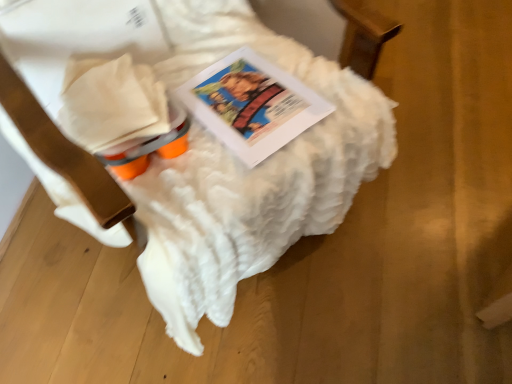
Measure the distance between matte paper book at center and camera.

matte paper book at center and camera are 30.23 inches apart.

Find the location of `matte paper book at center`. matte paper book at center is located at coordinates (251, 105).

This screenshot has width=512, height=384. Describe the element at coordinates (251, 105) in the screenshot. I see `matte paper book at center` at that location.

This screenshot has width=512, height=384. Describe the element at coordinates (248, 172) in the screenshot. I see `white fluffy blanket at upper center` at that location.

In order to face white fluffy blanket at upper center, should I rotate leftwards or rightwards?

To align with it, rotate left about 9.264°.

Find the location of a particular element. white fluffy blanket at upper center is located at coordinates (248, 172).

Where is `matte paper book at center`? The image size is (512, 384). matte paper book at center is located at coordinates (251, 105).

Which is more to the left, white fluffy blanket at upper center or matte paper book at center?

white fluffy blanket at upper center is more to the left.

Is white fluffy blanket at upper center closer to camera compared to matte paper book at center?

Yes, white fluffy blanket at upper center is closer to the camera.

Between point (199, 245) and point (284, 95), which one is positioned behind?

The point (284, 95) is farther from the camera.

From the image's perspective, is white fluffy blanket at upper center beneath matte paper book at center?

No, from the image's perspective, white fluffy blanket at upper center is not below matte paper book at center.

From a real-world perspective, who is located lower, white fluffy blanket at upper center or matte paper book at center?

matte paper book at center is physically lower.

Considering the relative sizes of white fluffy blanket at upper center and matte paper book at center in the image provided, is white fluffy blanket at upper center thinner than matte paper book at center?

In fact, white fluffy blanket at upper center might be wider than matte paper book at center.

Does white fluffy blanket at upper center have a lesser height compared to matte paper book at center?

In fact, white fluffy blanket at upper center may be taller than matte paper book at center.

Based on their sizes in the image, would you say white fluffy blanket at upper center is bigger or smaller than matte paper book at center?

white fluffy blanket at upper center is bigger than matte paper book at center.

Is matte paper book at center inside white fluffy blanket at upper center?

Yes.

Would you say white fluffy blanket at upper center is a long distance from matte paper book at center?

white fluffy blanket at upper center is near matte paper book at center, not far away.

Looking at this image, is white fluffy blanket at upper center aimed at matte paper book at center?

Yes.

How different are the orientations of white fluffy blanket at upper center and matte paper book at center in degrees?

white fluffy blanket at upper center and matte paper book at center are facing 2.24 degrees away from each other.

Locate an element on the screen. This screenshot has height=384, width=512. book on the right of white fluffy blanket at upper center is located at coordinates [251, 105].

Which object is positioned more to the left, matte paper book at center or white fluffy blanket at upper center?

From the viewer's perspective, white fluffy blanket at upper center appears more on the left side.

Does matte paper book at center lie behind white fluffy blanket at upper center?

Yes, matte paper book at center is further from the viewer.

Which is closer, (x=228, y=146) or (x=155, y=260)?

Point (x=228, y=146) appears to be farther away from the viewer than point (x=155, y=260).

From the image's perspective, which one is positioned higher, matte paper book at center or white fluffy blanket at upper center?

white fluffy blanket at upper center, from the image's perspective.

From a real-world perspective, is matte paper book at center physically below white fluffy blanket at upper center?

Correct, in the physical world, matte paper book at center is lower than white fluffy blanket at upper center.

Is matte paper book at center thinner than white fluffy blanket at upper center?

A: Yes.

Considering the relative sizes of matte paper book at center and white fluffy blanket at upper center in the image provided, is matte paper book at center taller than white fluffy blanket at upper center?

No, matte paper book at center is not taller than white fluffy blanket at upper center.

Between matte paper book at center and white fluffy blanket at upper center, which one has smaller size?

With smaller size is matte paper book at center.

Is matte paper book at center outside of white fluffy blanket at upper center?

That's incorrect, matte paper book at center is not completely outside white fluffy blanket at upper center.

Would you say matte paper book at center is a long distance from white fluffy blanket at upper center?

Actually, matte paper book at center and white fluffy blanket at upper center are a little close together.

Does matte paper book at center turn towards white fluffy blanket at upper center?

Yes, matte paper book at center faces towards white fluffy blanket at upper center.

This screenshot has width=512, height=384. I want to click on furniture above the matte paper book at center (from a real-world perspective), so click(x=248, y=172).

In the image, there is a white fluffy blanket at upper center. Identify the location of book below it (from the image's perspective). Image resolution: width=512 pixels, height=384 pixels. (251, 105).

Locate an element on the screen. This screenshot has width=512, height=384. book on the right side of white fluffy blanket at upper center is located at coordinates (251, 105).